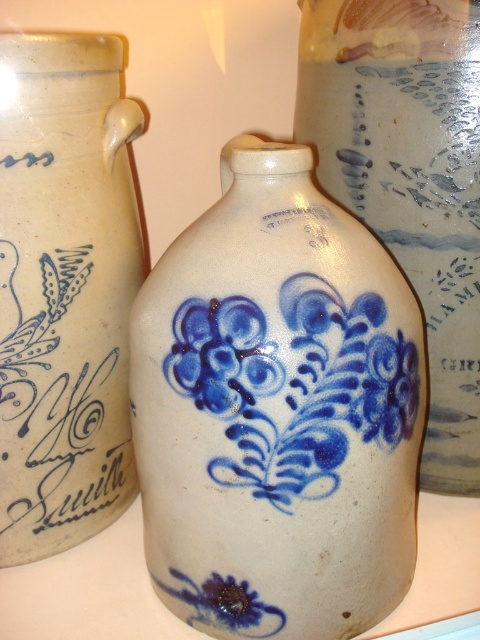
Looking at the antique display, you notice the blue painted ceramic vase at center and the blue painted floral design at center. Which one is positioned higher in the image?

The blue painted ceramic vase at center is above the blue painted floral design at center, so it is positioned higher.

You are an interior designer arranging these vases on a shelf. The shelf has limited height clearance. Which of the two vases, the white stoneware vase at center or the matte ceramic vase at left, will you choose to place on the shelf to ensure it fits within the height restriction?

The white stoneware vase at center is not as tall as the matte ceramic vase at left, so you should choose the white stoneware vase at center to ensure it fits within the height restriction.

You are an antique collector examining the image. You need to place a protective cover over the white stoneware vase at center and the matte ceramic vase at left. Which vase should you cover first if you want to start from the left side of the image?

You should cover the matte ceramic vase at left first because it is positioned to the left of the white stoneware vase at center.